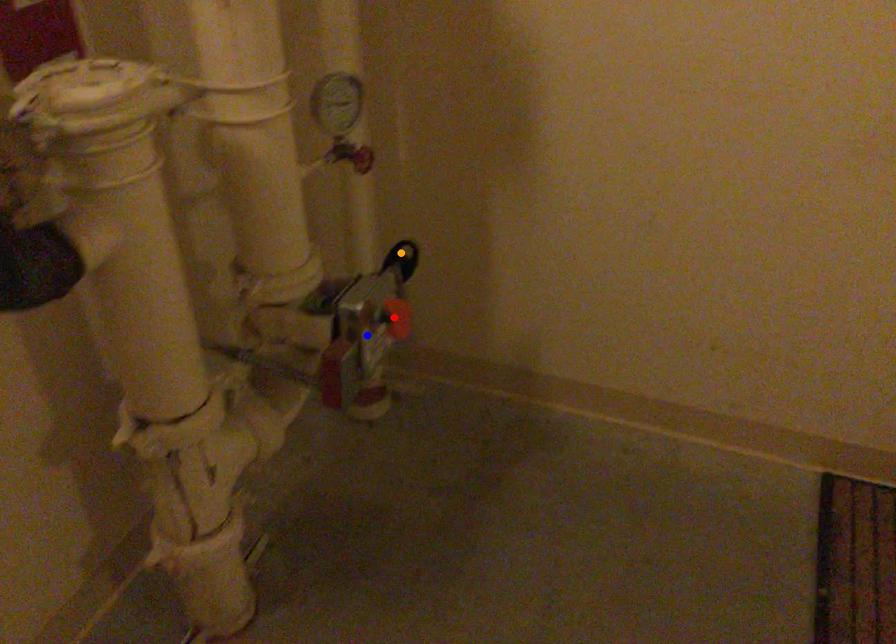
Order these from nearest to farthest:
blue point
orange point
red point

orange point → red point → blue point